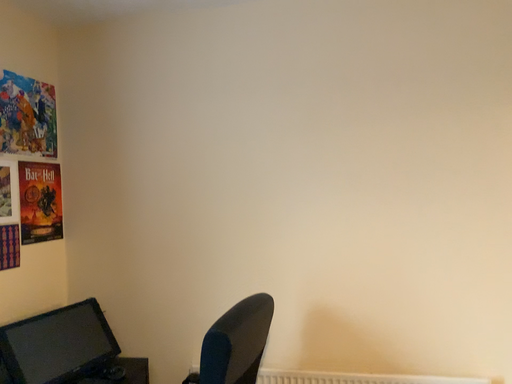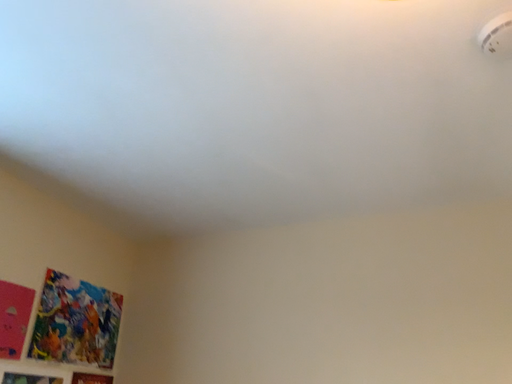
Question: How did the camera likely rotate when shooting the video?

Choices:
 (A) rotated right
 (B) rotated left

Answer: (B)